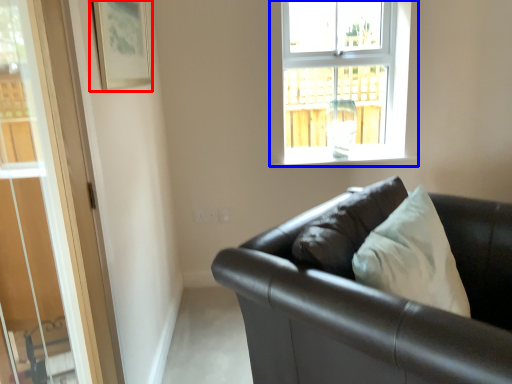
Question: Which object is further to the camera taking this photo, picture frame (highlighted by a red box) or window (highlighted by a blue box)?

Choices:
 (A) picture frame
 (B) window

Answer: (B)